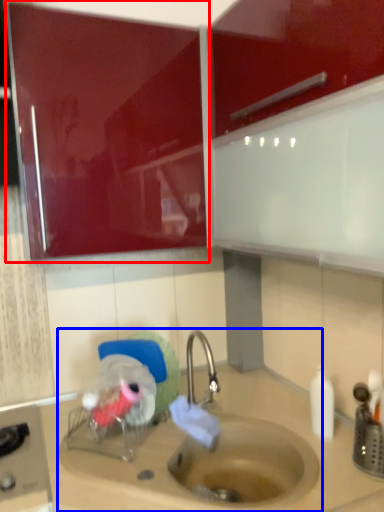
Question: Which object is closer to the camera taking this photo, cabinetry (highlighted by a red box) or sink (highlighted by a blue box)?

Choices:
 (A) cabinetry
 (B) sink

Answer: (B)